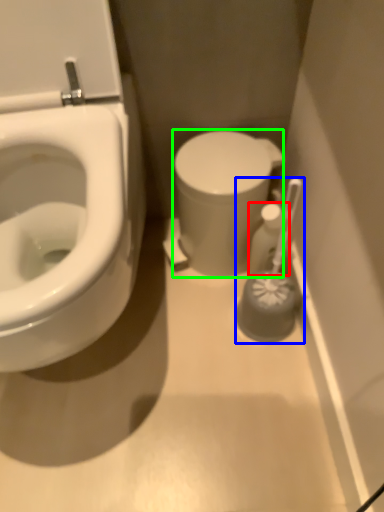
Question: Based on their relative distances, which object is farther from toiletry (highlighted by a red box)? Choose from brush (highlighted by a blue box) and porcelain (highlighted by a green box).

Choices:
 (A) brush
 (B) porcelain

Answer: (B)